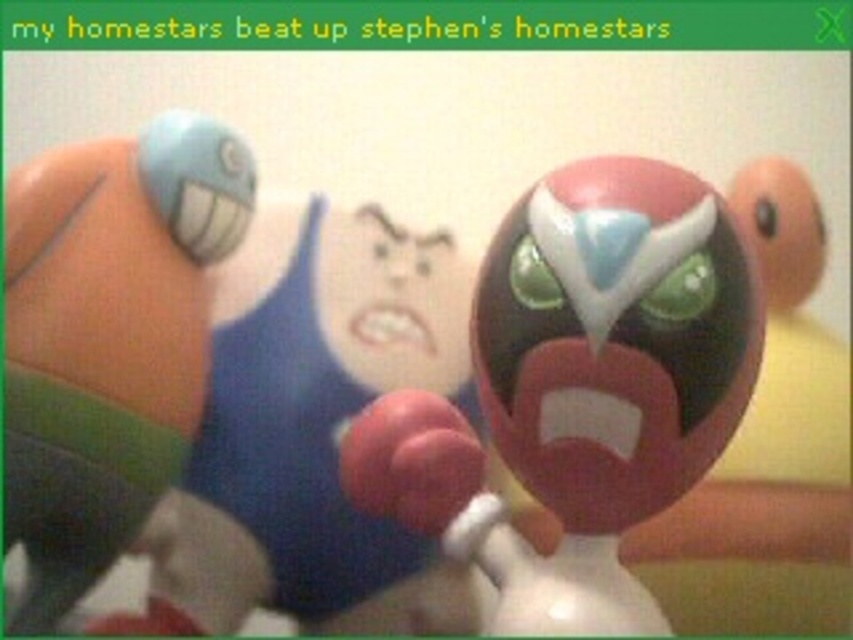
Is point (505, 412) in front of point (198, 186)?

That is True.

Does shiny plastic toy at center have a lesser height compared to matte plastic toy at left?

Yes.

Which is in front, point (665, 492) or point (112, 500)?

Point (665, 492) is more forward.

This screenshot has height=640, width=853. In order to click on shiny plastic toy at center in this screenshot , I will do `click(579, 388)`.